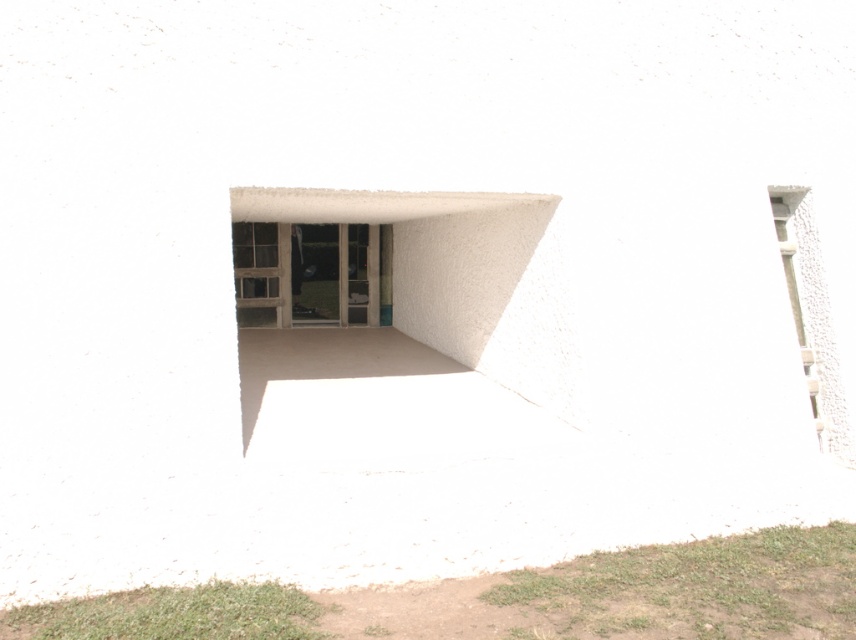
Question: Is transparent glass window at center closer to the viewer compared to smooth concrete window at right?

Choices:
 (A) yes
 (B) no

Answer: (B)

Question: Among these points, which one is nearest to the camera?

Choices:
 (A) (815, 378)
 (B) (286, 234)

Answer: (A)

Question: Which object is farther from the camera taking this photo?

Choices:
 (A) smooth concrete window at right
 (B) transparent glass window at center

Answer: (B)

Question: Can you confirm if transparent glass window at center is bigger than smooth concrete window at right?

Choices:
 (A) no
 (B) yes

Answer: (B)

Question: Is transparent glass window at center above smooth concrete window at right?

Choices:
 (A) no
 (B) yes

Answer: (B)